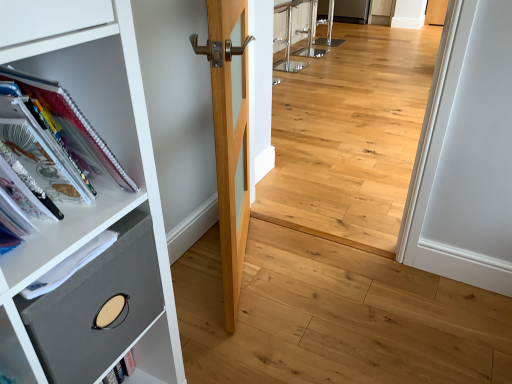
You are a GUI agent. You are given a task and a screenshot of the screen. Output one action in this format:
    pyautogui.click(x=<x>, y=<y>)
    Task: Click on the vacant area that lies in front of light wood door at center
    This screenshot has height=384, width=512.
    Given the screenshot: What is the action you would take?
    pyautogui.click(x=264, y=334)